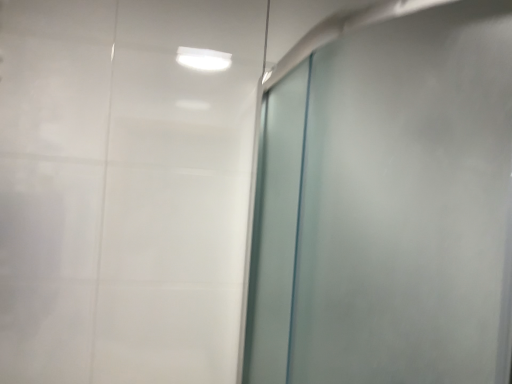
Question: Should I look upward or downward to see frosted glass door at right?

Choices:
 (A) up
 (B) down

Answer: (B)